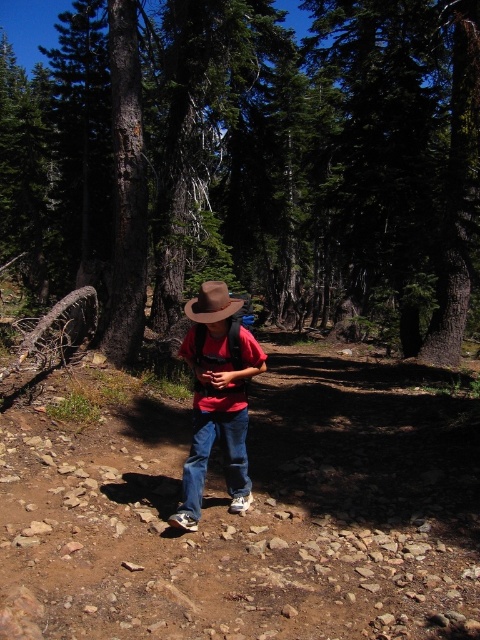
Who is lower down, matte red shirt at center or brown felt cowboy hat at center?

matte red shirt at center is below.

Does point (264, 355) lie behind point (212, 291)?

Yes, it is.

What do you see at coordinates (217, 397) in the screenshot?
I see `matte red shirt at center` at bounding box center [217, 397].

Identify the location of matte red shirt at center. (217, 397).

Can you confirm if matte red shirt at center is positioned above denim at center?

Yes, matte red shirt at center is above denim at center.

Measure the distance between point (238, 429) and camera.

Point (238, 429) is 4.05 meters away from camera.

Is point (183, 340) positioned in front of point (230, 508)?

No, (183, 340) is behind (230, 508).

Find the location of a particular element. matte red shirt at center is located at coordinates (217, 397).

How far apart are denim at center and brown felt cowboy hat at center?

They are 3.83 feet apart.

Does denim at center appear on the left side of brown felt cowboy hat at center?

In fact, denim at center is to the right of brown felt cowboy hat at center.

Which is behind, point (192, 451) or point (228, 298)?

The point (192, 451) is behind.

The width and height of the screenshot is (480, 640). Find the location of `denim at center`. denim at center is located at coordinates (206, 464).